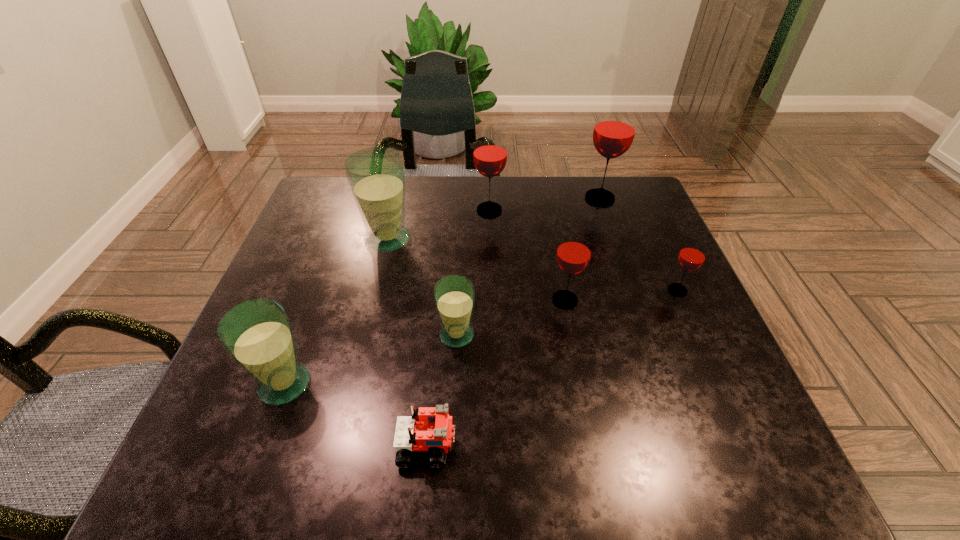
The height and width of the screenshot is (540, 960). Find the location of `vacant area at the far right corner of the desktop`. vacant area at the far right corner of the desktop is located at coordinates (619, 213).

Where is `free space between the third red glass from right to left and the rightmost glass`? Image resolution: width=960 pixels, height=540 pixels. free space between the third red glass from right to left and the rightmost glass is located at coordinates (621, 295).

This screenshot has width=960, height=540. I want to click on free spot between the smallest blue glass and the second object from right to left, so click(528, 267).

You are a GUI agent. You are given a task and a screenshot of the screen. Output one action in this format:
    pyautogui.click(x=<x>, y=<y>)
    Task: Click on the free space between the third glass from right to left and the nearest glass
    The width and height of the screenshot is (960, 540).
    Given the screenshot: What is the action you would take?
    pyautogui.click(x=425, y=342)

Identify the location of vacant area that lies between the Lego and the sixth object from left to right. The image size is (960, 540). (496, 373).

You are a GUI agent. You are given a task and a screenshot of the screen. Output one action in this format:
    pyautogui.click(x=<x>, y=<y>)
    Task: Click on the vacant area that lies between the third glass from right to left and the leftmost glass
    The height and width of the screenshot is (540, 960).
    Given the screenshot: What is the action you would take?
    pyautogui.click(x=425, y=342)

You are a GUI agent. You are given a task and a screenshot of the screen. Output one action in this format:
    pyautogui.click(x=<x>, y=<y>)
    Task: Click on the vacant region between the red Lego and the sixth farthest glass
    This screenshot has width=960, height=540.
    Given the screenshot: What is the action you would take?
    pyautogui.click(x=443, y=390)

This screenshot has width=960, height=540. I want to click on free space between the nearest object and the sixth farthest glass, so click(443, 390).

You are a GUI agent. You are given a task and a screenshot of the screen. Output one action in this format:
    pyautogui.click(x=<x>, y=<y>)
    Task: Click on the free area in between the sixth glass from left to right and the rightmost object
    The width and height of the screenshot is (960, 540).
    Given the screenshot: What is the action you would take?
    pyautogui.click(x=638, y=244)

Locate an element on the screen. free space between the tallest object and the sixth glass from right to left is located at coordinates (493, 219).